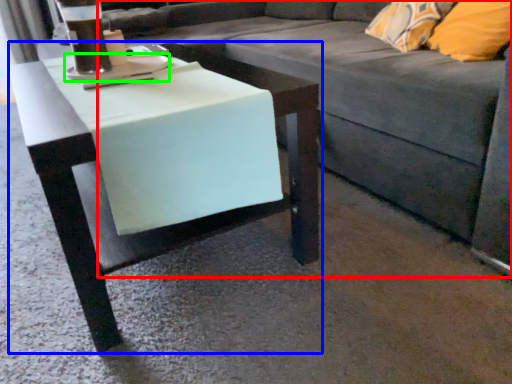
Question: Which object is the closest to the studio couch (highlighted by a red box)? Choose among these: table (highlighted by a blue box) or saucer (highlighted by a green box).

Choices:
 (A) table
 (B) saucer

Answer: (A)